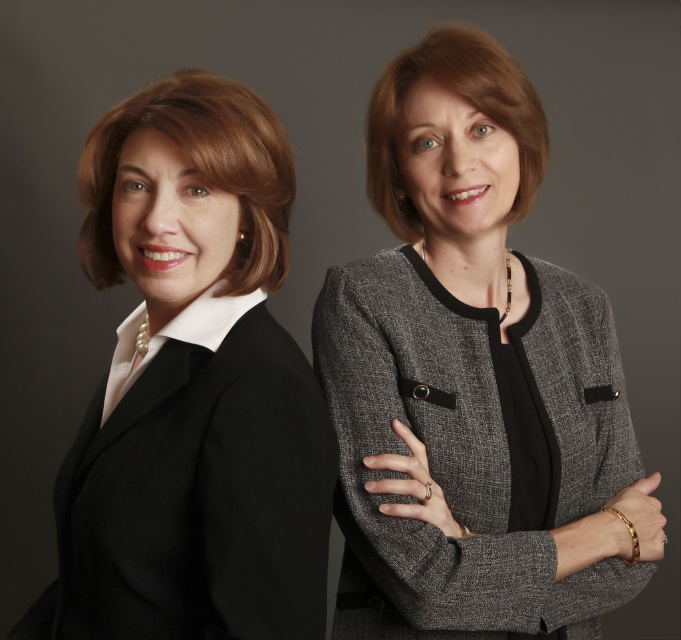
Is point (513, 586) closer to viewer compared to point (285, 435)?

That is False.

What do you see at coordinates (475, 380) in the screenshot?
I see `matte gray blazer at center` at bounding box center [475, 380].

Locate an element on the screen. The image size is (681, 640). matte gray blazer at center is located at coordinates (475, 380).

Find the location of `matte gray blazer at center`. matte gray blazer at center is located at coordinates (475, 380).

Which is more to the right, matte gray blazer at center or gray textured blazer at center?

gray textured blazer at center is more to the right.

Is matte gray blazer at center to the right of gray textured blazer at center from the viewer's perspective?

Incorrect, matte gray blazer at center is not on the right side of gray textured blazer at center.

Describe the element at coordinates (475, 380) in the screenshot. I see `matte gray blazer at center` at that location.

At what (x,y) coordinates should I click in order to perform the action: click on matte gray blazer at center. Please return your answer as a coordinate pair (x, y). This screenshot has width=681, height=640. Looking at the image, I should click on (475, 380).

Which is below, black matte blazer at left or gray textured blazer at center?

gray textured blazer at center is below.

Between black matte blazer at left and gray textured blazer at center, which one has less height?

gray textured blazer at center

Is point (116, 520) more distant than point (494, 292)?

No.

The width and height of the screenshot is (681, 640). In order to click on black matte blazer at left in this screenshot , I will do `click(191, 387)`.